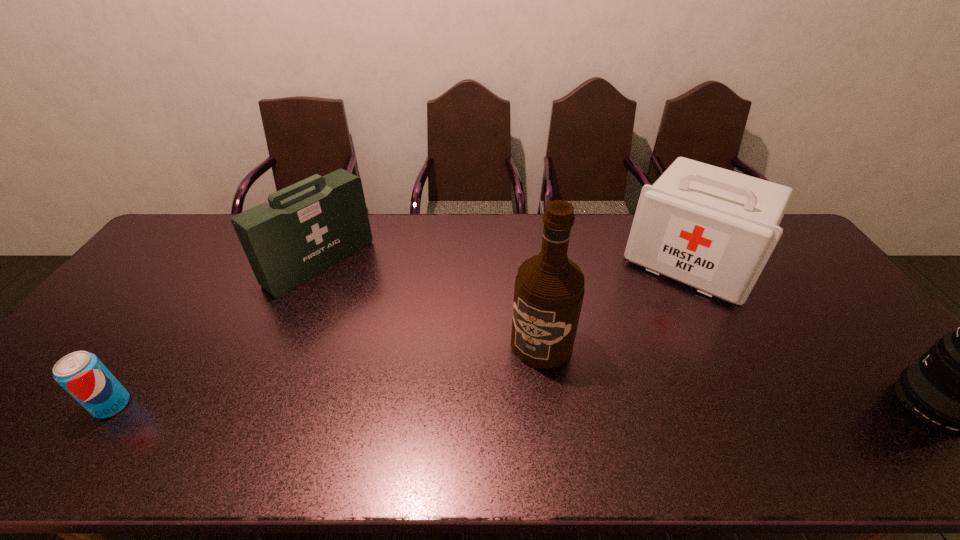
In the image, there is a desktop. Identify the location of vacant space at the right edge. (780, 273).

You are a GUI agent. You are given a task and a screenshot of the screen. Output one action in this format:
    pyautogui.click(x=<x>, y=<y>)
    Task: Click on the free space between the left first-aid kit and the fourth object from left to right
    
    Given the screenshot: What is the action you would take?
    tap(506, 262)

Image resolution: width=960 pixels, height=540 pixels. Identify the location of free space between the leftmost object and the alcohol. (326, 374).

Locate an element on the screen. The width and height of the screenshot is (960, 540). free area in between the third nearest object and the shortest object is located at coordinates (326, 374).

You are a GUI agent. You are given a task and a screenshot of the screen. Output one action in this format:
    pyautogui.click(x=<x>, y=<y>)
    Task: Click on the unoccupied area between the fourth object from left to right and the left first-aid kit
    The width and height of the screenshot is (960, 540).
    Given the screenshot: What is the action you would take?
    pyautogui.click(x=506, y=262)

You are a GUI agent. You are given a task and a screenshot of the screen. Output one action in this format:
    pyautogui.click(x=<x>, y=<y>)
    Task: Click on the unoccupied position between the tallest object and the second object from right to left
    The image size is (960, 540).
    Given the screenshot: What is the action you would take?
    pyautogui.click(x=616, y=302)

The height and width of the screenshot is (540, 960). In order to click on object identified as the closest to the fourth object from right to left in this screenshot , I will do `click(81, 374)`.

Select which object appears as the second closest to the telephoto lens. Please provide its 2D coordinates. Your answer should be formatted as a tuple, i.e. [(x, y)], where the tuple contains the x and y coordinates of a point satisfying the conditions above.

[(549, 288)]

I want to click on vacant area that satisfies the following two spatial constraints: 1. on the back side of the alcohol; 2. on the right side of the soda can, so click(155, 343).